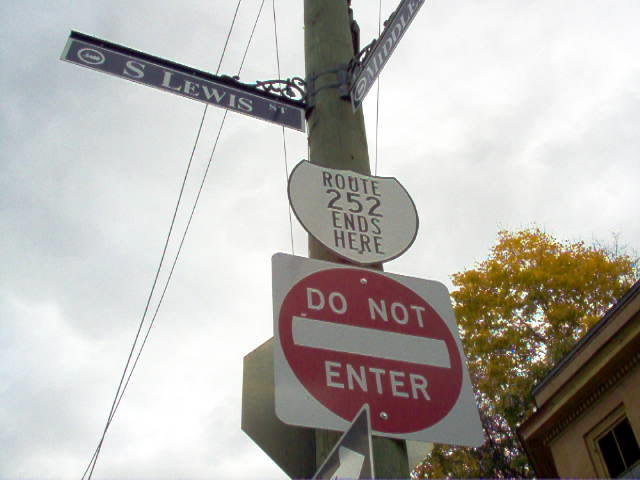
Find the location of `screws`. screws is located at coordinates (386, 418), (367, 283).